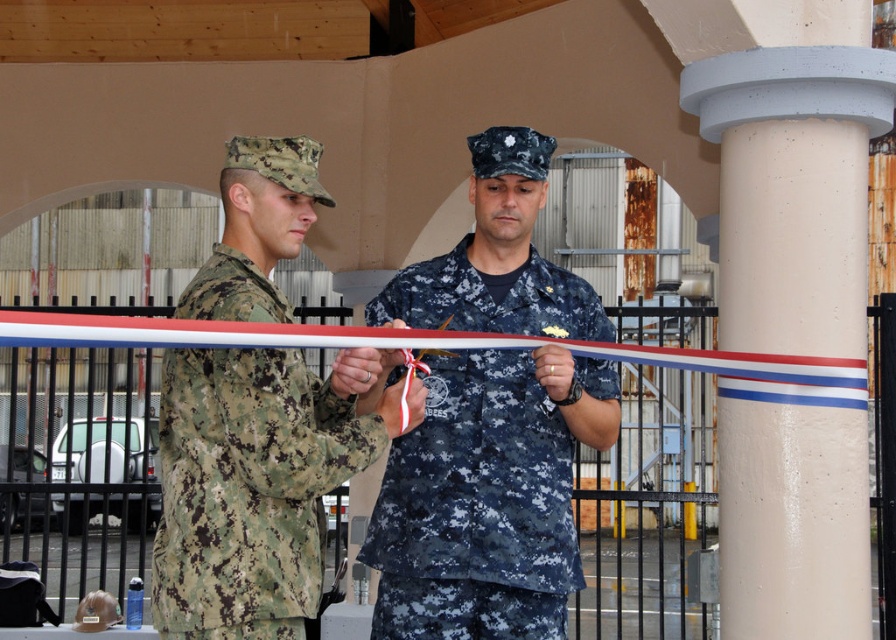
Question: Does navy blue camouflage uniform at center come in front of camouflage fabric uniform at left?

Choices:
 (A) yes
 (B) no

Answer: (B)

Question: Which of the following is the closest to the observer?

Choices:
 (A) navy blue camouflage uniform at center
 (B) white concrete pillar at center
 (C) camouflage fabric uniform at left

Answer: (C)

Question: Which point is closer to the camera?

Choices:
 (A) [554, 515]
 (B) [754, 348]
 (C) [166, 472]

Answer: (C)

Question: Can you confirm if white concrete pillar at center is positioned above camouflage fabric uniform at left?

Choices:
 (A) no
 (B) yes

Answer: (B)

Question: Which point is closer to the camera?

Choices:
 (A) (777, 353)
 (B) (547, 536)

Answer: (B)

Question: In this image, where is white concrete pillar at center located relative to camouflage fabric uniform at left?

Choices:
 (A) above
 (B) below

Answer: (A)